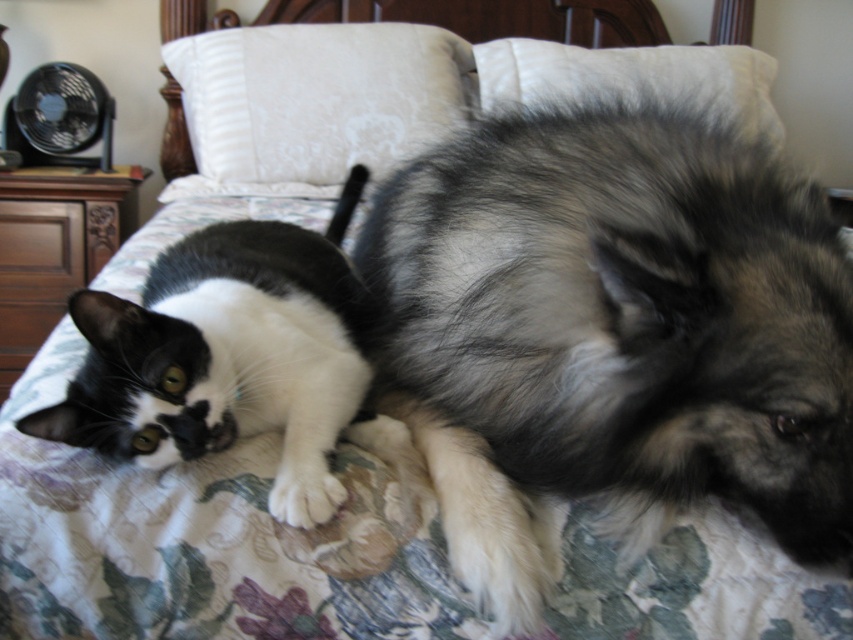
Question: Is black and white fur cat at center wider than white textured pillow at upper center?

Choices:
 (A) yes
 (B) no

Answer: (B)

Question: Does white damask pillow at upper center have a lesser width compared to white textured pillow at upper center?

Choices:
 (A) no
 (B) yes

Answer: (B)

Question: Is white soft pillow at upper center thinner than white textured pillow at upper center?

Choices:
 (A) yes
 (B) no

Answer: (A)

Question: Based on their relative distances, which object is farther from the white soft pillow at upper center?

Choices:
 (A) white textured pillow at upper center
 (B) white damask pillow at upper center
 (C) black and white fur cat at center

Answer: (C)

Question: Among these points, which one is nearest to the camera?

Choices:
 (A) (235, 160)
 (B) (200, 353)

Answer: (B)

Question: Which of the following is the closest to the observer?

Choices:
 (A) black and white fur cat at center
 (B) white textured pillow at upper center
 (C) white soft pillow at upper center

Answer: (A)